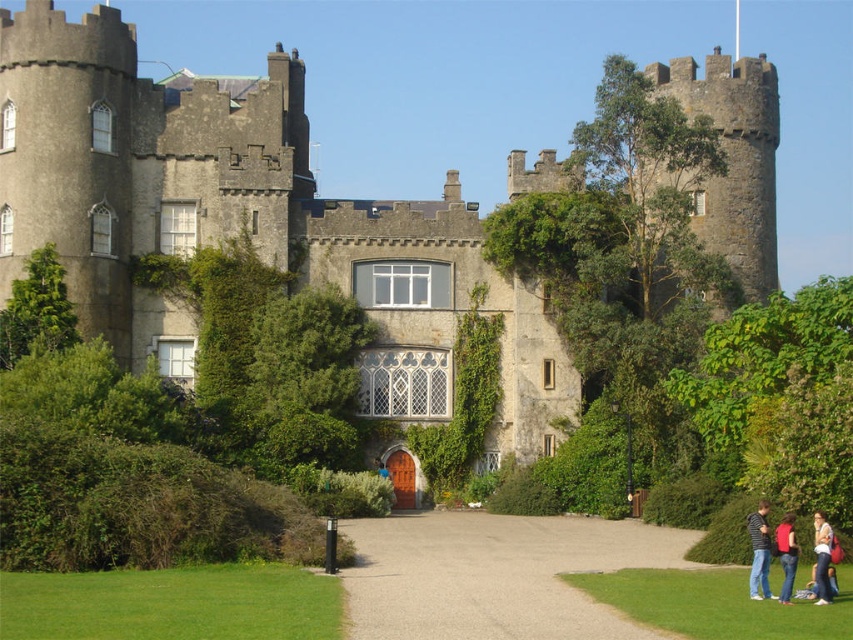
Question: Where is striped cotton shirt at lower right located in relation to red fabric jacket at lower right in the image?

Choices:
 (A) below
 (B) above

Answer: (B)

Question: Which point is closer to the camera taking this photo?

Choices:
 (A) pos(788,529)
 (B) pos(120,70)

Answer: (A)

Question: Is stone castle at center bigger than striped cotton shirt at lower right?

Choices:
 (A) yes
 (B) no

Answer: (A)

Question: Which point is farther to the camera?

Choices:
 (A) (109, 337)
 (B) (778, 596)
 (C) (828, 557)

Answer: (A)

Question: Which object is closer to the camera taking this photo?

Choices:
 (A) red fabric jacket at lower right
 (B) striped cotton shirt at lower right
 (C) smooth gravel path at center
 (D) stone castle at center

Answer: (C)

Question: Can you confirm if stone castle at center is smaller than striped cotton shirt at lower right?

Choices:
 (A) yes
 (B) no

Answer: (B)